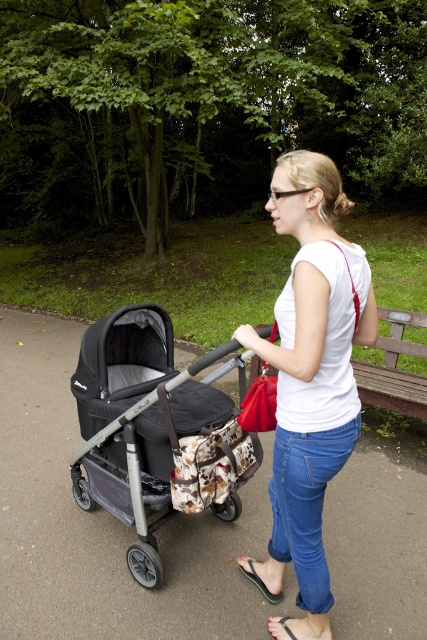
Between white matte shirt at center and black fabric sandal at lower center, which one appears on the right side from the viewer's perspective?

white matte shirt at center

Find the location of a particular element. white matte shirt at center is located at coordinates (312, 362).

Which is in front, point (304, 170) or point (254, 563)?

Point (304, 170) is more forward.

At what (x,y) coordinates should I click in order to perform the action: click on white matte shirt at center. Please return your answer as a coordinate pair (x, y). Looking at the image, I should click on (x=312, y=362).

Between white matte shirt at center and black leather sandal at lower center, which one has more height?

white matte shirt at center

Can you confirm if white matte shirt at center is positioned to the right of black leather sandal at lower center?

Correct, you'll find white matte shirt at center to the right of black leather sandal at lower center.

Which is in front, point (310, 390) or point (295, 637)?

Point (310, 390)

I want to click on white matte shirt at center, so click(312, 362).

Does black leather sandal at lower center have a lesser height compared to black fabric sandal at lower center?

Correct, black leather sandal at lower center is not as tall as black fabric sandal at lower center.

Looking at this image, which is above, black leather sandal at lower center or black fabric sandal at lower center?

Positioned higher is black fabric sandal at lower center.

Describe the element at coordinates (301, 627) in the screenshot. This screenshot has width=427, height=640. I see `black leather sandal at lower center` at that location.

Locate an element on the screen. The height and width of the screenshot is (640, 427). black leather sandal at lower center is located at coordinates (301, 627).